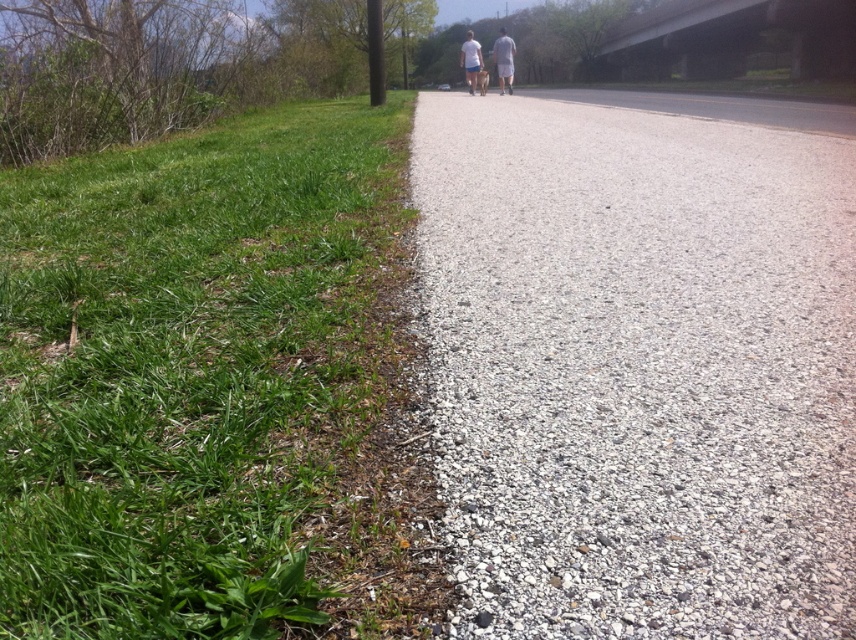
Question: Is green grass at left to the right of white cotton shirt at center from the viewer's perspective?

Choices:
 (A) yes
 (B) no

Answer: (B)

Question: Which object is positioned farthest from the light blue cotton shirt at center?

Choices:
 (A) gray gravel at center
 (B) green grass at left
 (C) gray cotton shorts at center

Answer: (B)

Question: Based on their relative distances, which object is farther from the green grass at left?

Choices:
 (A) light blue cotton shirt at center
 (B) gray gravel at center
 (C) white cotton shirt at center

Answer: (C)

Question: Can you confirm if gray cotton shorts at center is positioned below white cotton shirt at center?

Choices:
 (A) yes
 (B) no

Answer: (B)

Question: Which object is the farthest from the gray cotton shorts at center?

Choices:
 (A) green grass at left
 (B) white cotton shirt at center

Answer: (A)

Question: Can you confirm if light blue cotton shirt at center is smaller than white cotton shirt at center?

Choices:
 (A) yes
 (B) no

Answer: (B)